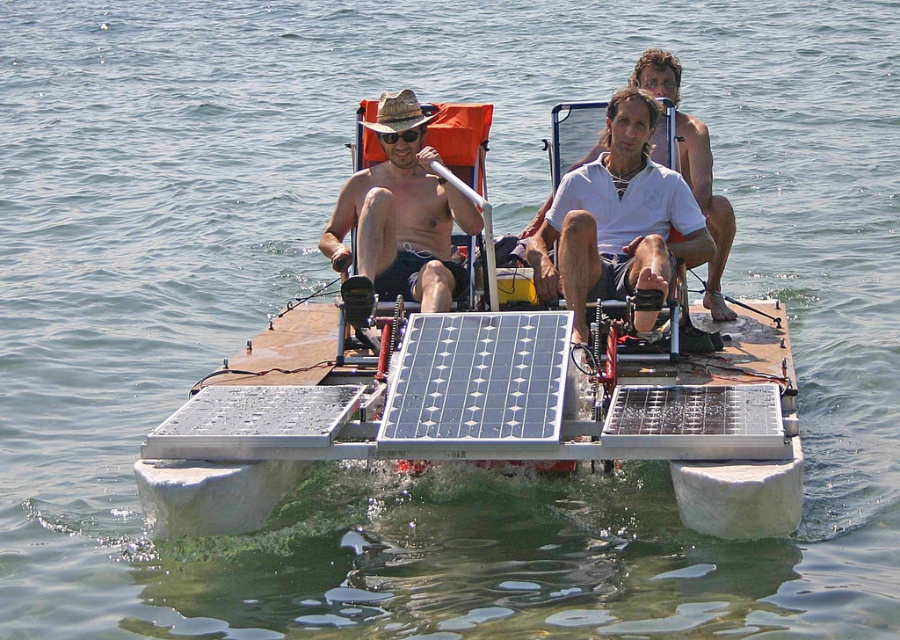
You are a passenger on the solar boat and want to locate your items. Where is the matte straw hat at center in relation to the matte black goggles at center?

The matte straw hat at center is located to the right of the matte black goggles at center.

You are a photographer standing on the dock. You want to take a photo of the silvery metallic solar panel at center. The camera is set to a focal length of 100mm. According to the rule of thirds, where should you position the solar panel in the frame to ensure it is the main focus?

The rule of thirds involves dividing the frame into a 3x3 grid and placing the subject at the intersection points. To make the silvery metallic solar panel at center the main focus, position it at one of the intersection points where a horizontal and vertical line meet, ensuring it aligns with the grid for a balanced composition.